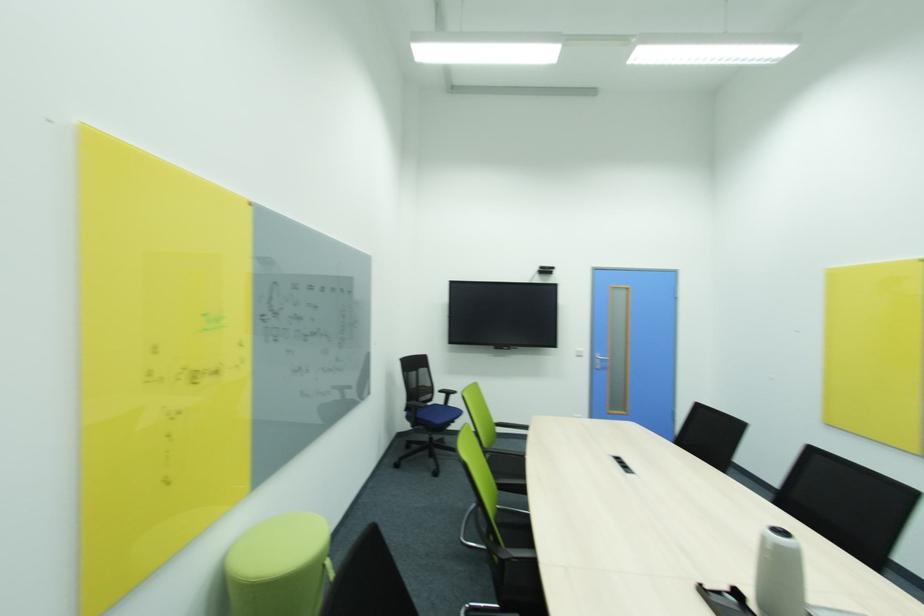
Identify the location of green stool. This screenshot has height=616, width=924. (280, 565).